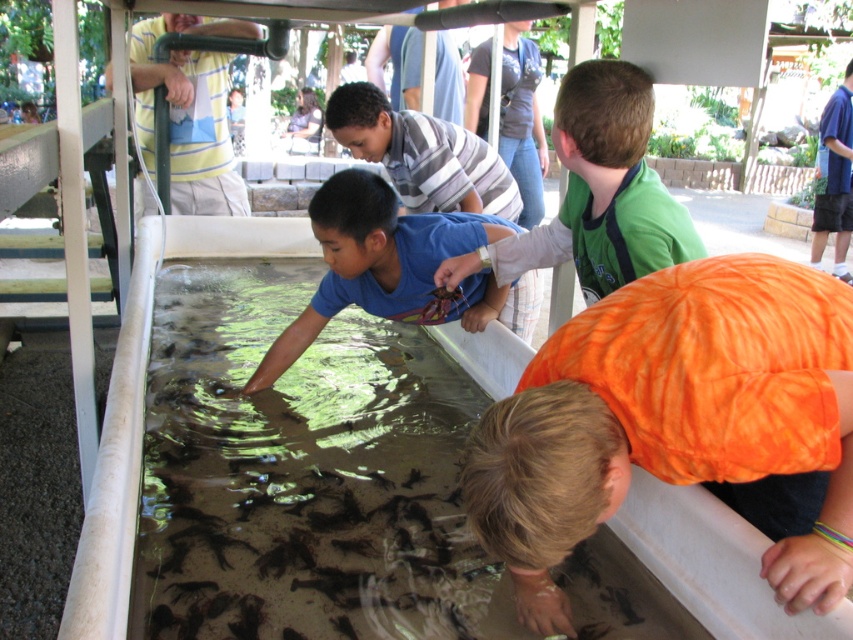
You are a teacher supervising the children at the outdoor facility. You notice the clear plastic tank at center and the blue cotton shirt at center. Which object is positioned to the left from your viewpoint?

The clear plastic tank at center is to the left of the blue cotton shirt at center from your viewpoint.

You are a photographer trying to capture a closeup of the fish tank at the educational facility. You notice two points marked on the tank surface at coordinates point (x=350, y=632) and point (x=839, y=108). Which point should you focus on to get a clearer image of the fish tank surface?

Point (x=350, y=632) is closer to the camera than point (x=839, y=108), so focusing on point (x=350, y=632) will provide a clearer image of the fish tank surface.